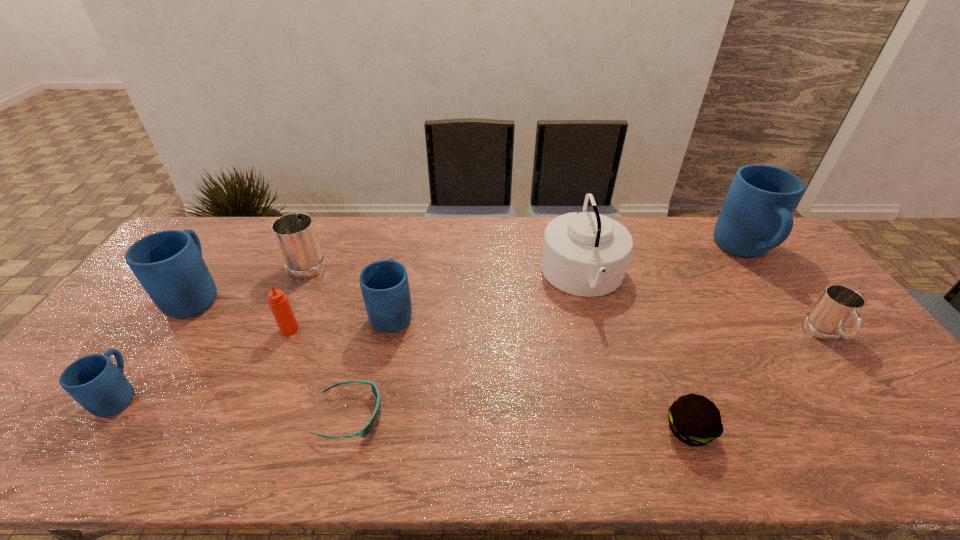
Identify the location of vacant area situated on the side of the nearest mug with the handle. The width and height of the screenshot is (960, 540). (147, 357).

Where is `free space located on the side of the nearest mug with the handle`? The image size is (960, 540). free space located on the side of the nearest mug with the handle is located at coordinates (205, 273).

In order to click on vacant space located on the right of the patty in this screenshot , I will do `click(774, 430)`.

You are a GUI agent. You are given a task and a screenshot of the screen. Output one action in this format:
    pyautogui.click(x=<x>, y=<y>)
    Task: Click on the free space located 0.050m on the front-facing side of the shortest object
    The width and height of the screenshot is (960, 540).
    Given the screenshot: What is the action you would take?
    pyautogui.click(x=404, y=415)

The image size is (960, 540). I want to click on kettle that is at the far edge, so click(584, 253).

You are a GUI agent. You are given a task and a screenshot of the screen. Output one action in this format:
    pyautogui.click(x=<x>, y=<y>)
    Task: Click on the patty located in the near edge section of the desktop
    Image resolution: width=960 pixels, height=540 pixels.
    Given the screenshot: What is the action you would take?
    pyautogui.click(x=695, y=420)

Identify the location of sunglasses that is at the near edge. Image resolution: width=960 pixels, height=540 pixels. pos(368,428).

The width and height of the screenshot is (960, 540). What are the coordinates of `object that is at the far right corner` in the screenshot? It's located at (755, 217).

In the image, there is a desktop. At what (x,y) coordinates should I click in order to perform the action: click on vacant area at the far edge. Please return your answer as a coordinate pair (x, y). This screenshot has height=540, width=960. Looking at the image, I should click on (444, 247).

Locate an element on the screen. The height and width of the screenshot is (540, 960). vacant space at the near edge is located at coordinates (732, 456).